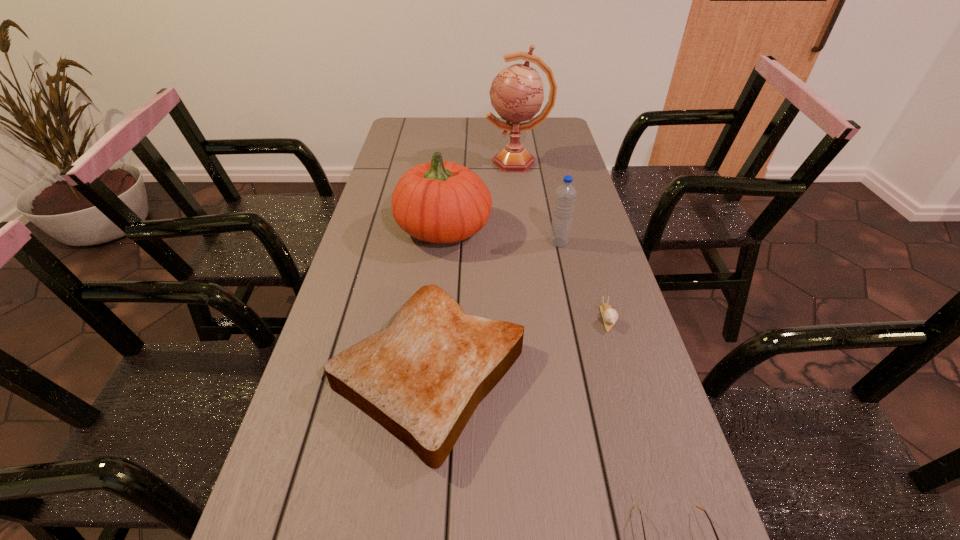
Where is `the tallest object`? The image size is (960, 540). the tallest object is located at coordinates (516, 93).

Identify the location of the farthest object. This screenshot has width=960, height=540. (516, 93).

What are the coordinates of `pumpkin` in the screenshot? It's located at (439, 202).

Locate an element on the screen. The height and width of the screenshot is (540, 960). water bottle is located at coordinates (565, 195).

Locate an element on the screen. The width and height of the screenshot is (960, 540). the fourth tallest object is located at coordinates (421, 378).

At what (x,y) coordinates should I click in order to perform the action: click on escargot. Please return your answer as a coordinate pair (x, y). The height and width of the screenshot is (540, 960). Looking at the image, I should click on (610, 316).

The image size is (960, 540). Identify the location of blank space located 0.200m on the front-facing side of the globe. (432, 163).

Locate an element on the screen. The image size is (960, 540). vacant region located 0.280m on the front-facing side of the globe is located at coordinates (410, 163).

What are the coordinates of `vacant area situated 0.220m on the front-facing side of the globe` in the screenshot? It's located at (426, 163).

Locate an element on the screen. vacant space located on the back of the pumpkin is located at coordinates (449, 176).